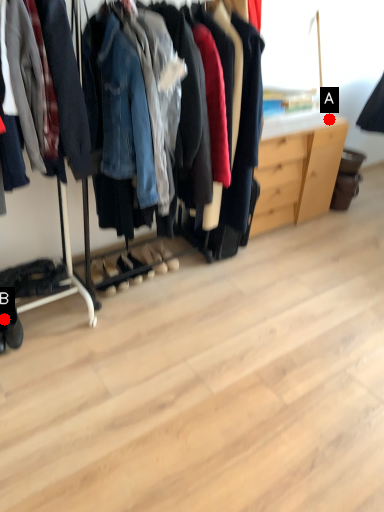
Question: Two points are circled on the image, labeled by A and B beside each circle. Which point is farther to the camera?

Choices:
 (A) A is further
 (B) B is further

Answer: (A)